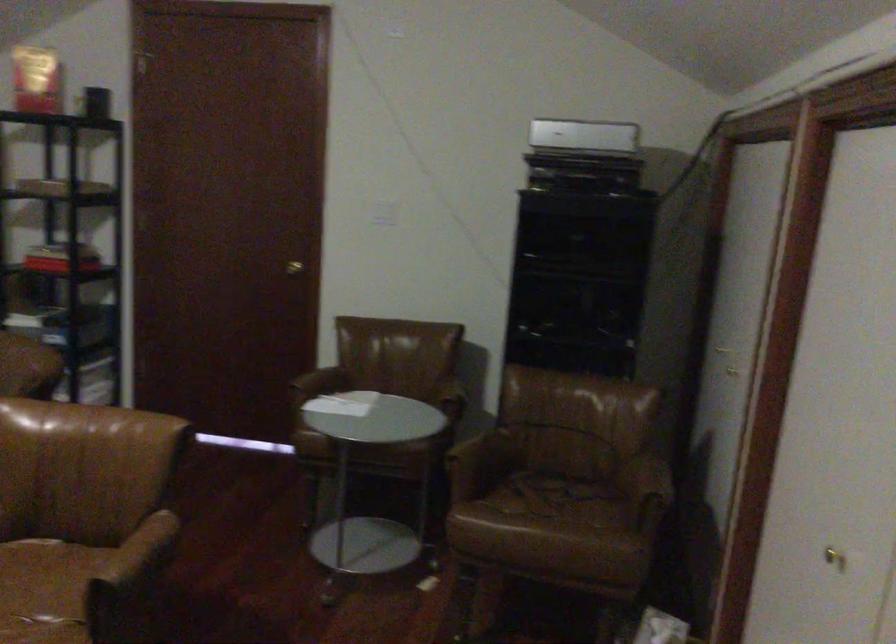
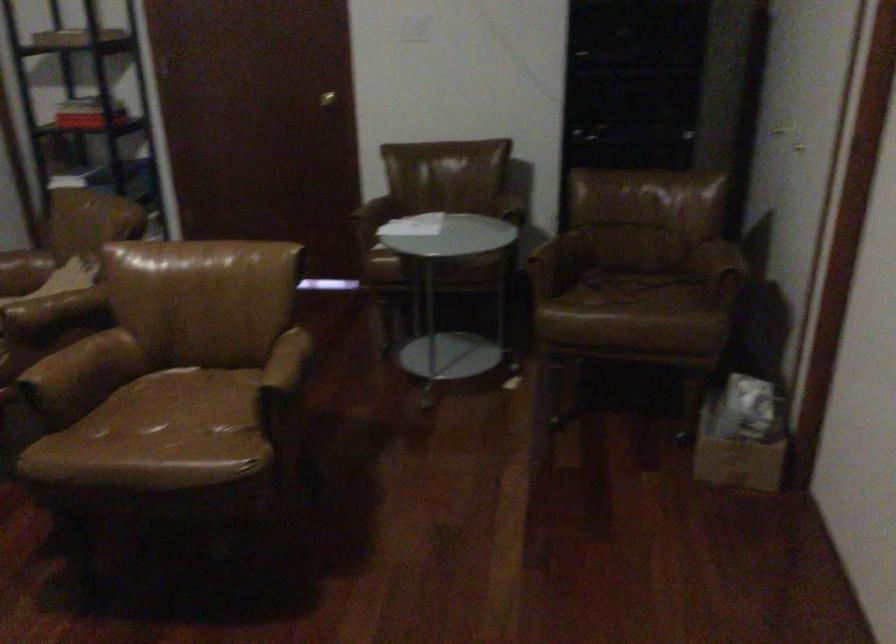
Where in the second image is the point corresponding to the point at 549,498 from the first image?

(627, 288)